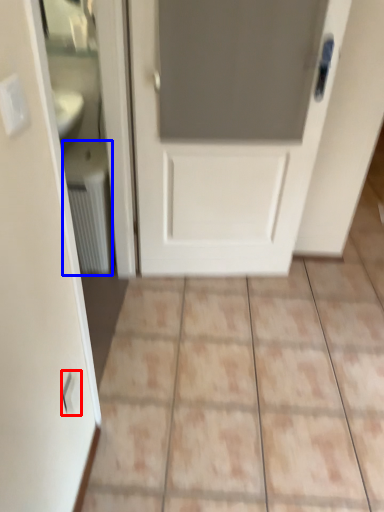
Question: Which point is closer to the camera, electric outlet (highlighted by a red box) or radiator (highlighted by a blue box)?

Choices:
 (A) electric outlet
 (B) radiator

Answer: (A)